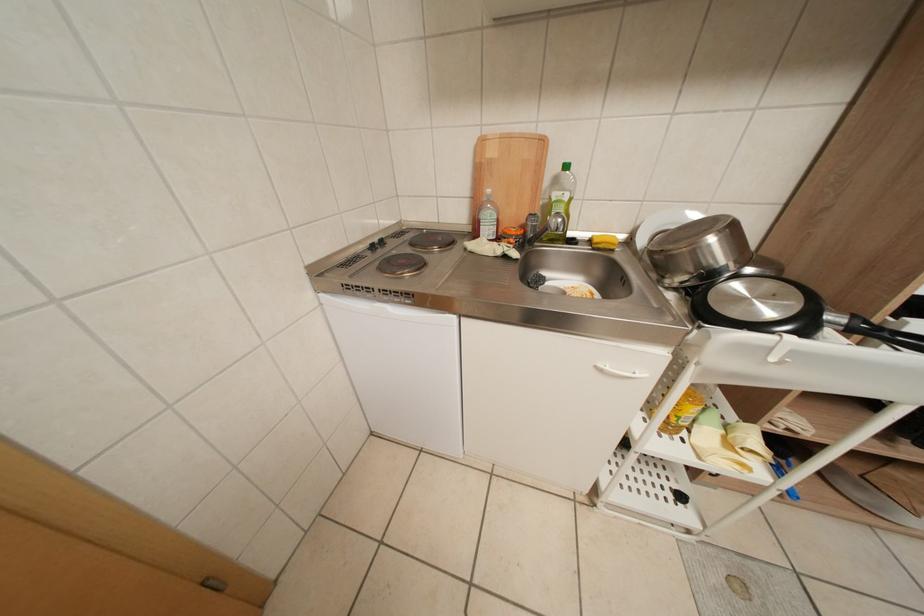
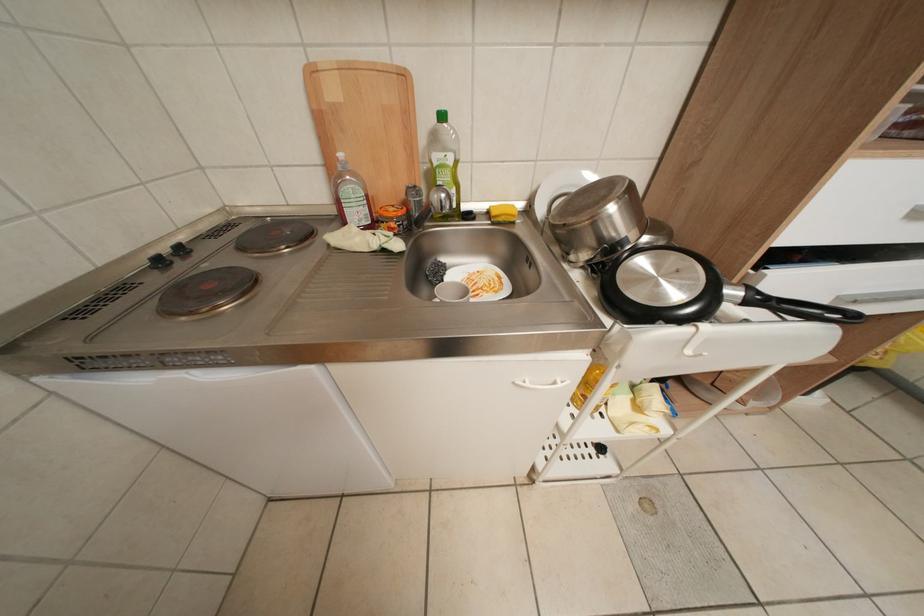
Which direction would the cameraman need to move to produce the second image?

The cameraman moved toward right, forward.